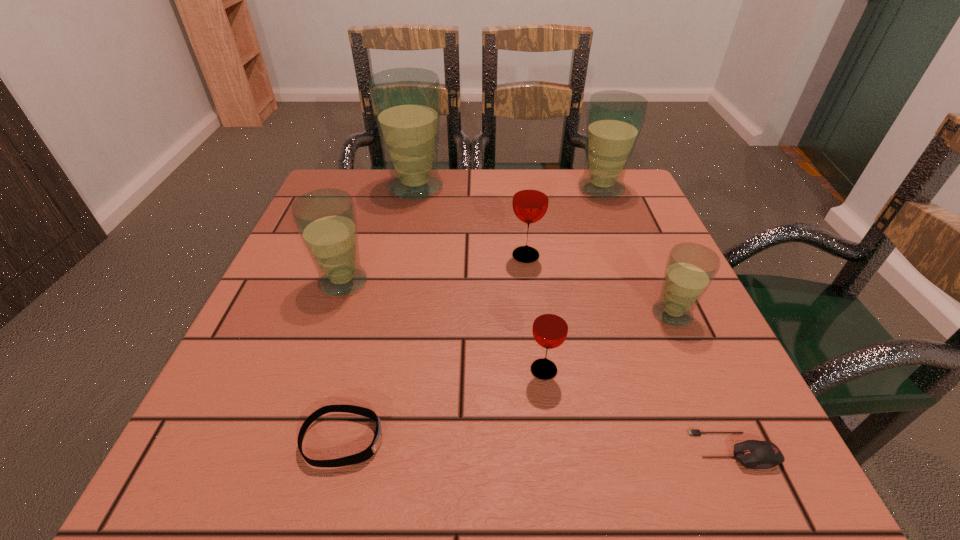
The width and height of the screenshot is (960, 540). In the image, there is a desktop. Find the location of `free space at the right edge`. free space at the right edge is located at coordinates (628, 322).

Locate an element on the screen. vacant area at the far left corner is located at coordinates (327, 184).

Locate an element on the screen. This screenshot has height=540, width=960. blank space at the far right corner of the desktop is located at coordinates (646, 219).

The image size is (960, 540). In the image, there is a desktop. What are the coordinates of `vacant space at the near right corner` in the screenshot? It's located at (688, 487).

Where is `free space between the wristband and the tallest glass`? The height and width of the screenshot is (540, 960). free space between the wristband and the tallest glass is located at coordinates (379, 313).

Locate an element on the screen. The height and width of the screenshot is (540, 960). vacant area that lies between the bigger red glass and the biggest blue glass is located at coordinates (470, 221).

At what (x,y) coordinates should I click in order to perform the action: click on vacant point located between the wristband and the smallest blue glass. Please return your answer as a coordinate pair (x, y). The height and width of the screenshot is (540, 960). Looking at the image, I should click on (508, 377).

Identify the location of free space that is in between the wristband and the seventh shortest object. The image size is (960, 540). click(x=472, y=314).

At what (x,y) coordinates should I click in order to perform the action: click on vacant area between the mouse and the smallest blue glass. Please return your answer as a coordinate pair (x, y). Looking at the image, I should click on point(704,382).

Where is `vacant area between the nearer red glass and the bigger red glass`? vacant area between the nearer red glass and the bigger red glass is located at coordinates (535, 313).